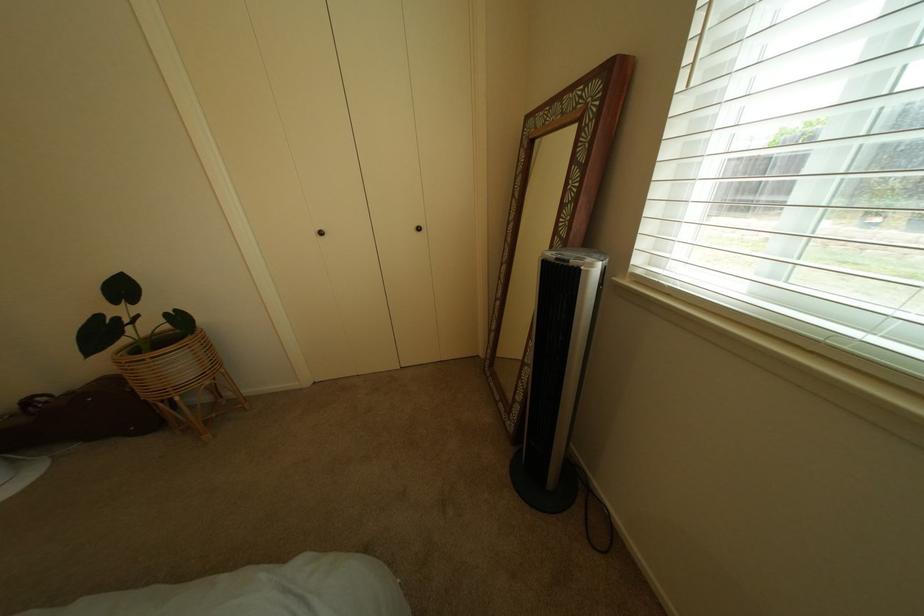
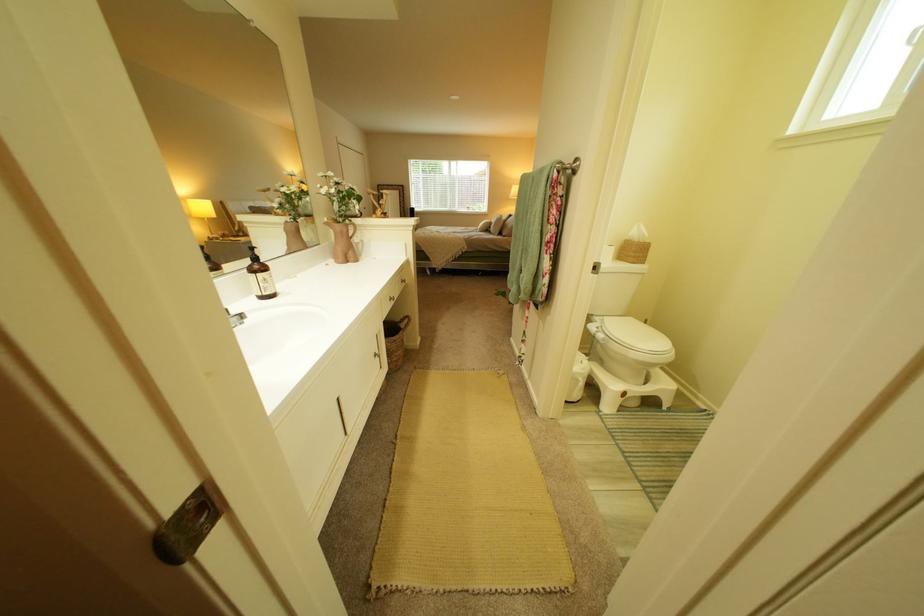
Question: I am providing you with two images of the same scene from different viewpoints. Please identify which objects are invisible in image2.

Choices:
 (A) white drawer knob
 (B) fan control panel
 (C) tripod leg clamp
 (D) toilet flush lever

Answer: (B)